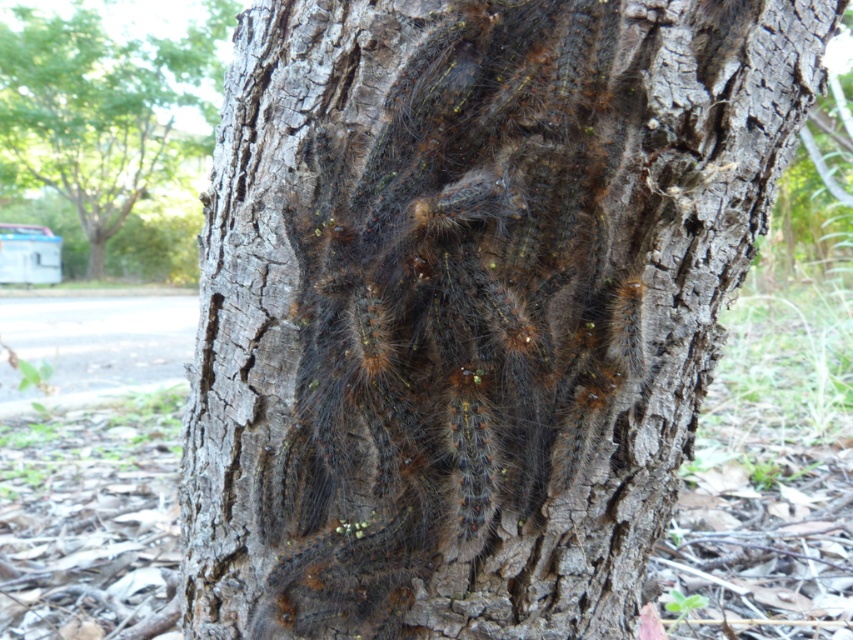
You are an entomologist observing the tree trunk. You notice two clusters of caterpillars. Which cluster, the fuzzy brown caterpillars at center or the brown fuzzy caterpillars at upper center, covers a smaller area of the tree trunk?

The fuzzy brown caterpillars at center occupies less space than brown fuzzy caterpillars at upper center, so the fuzzy brown caterpillars at center covers a smaller area.

In the scene shown: You are a bird flying over a tree in the park. You see fuzzy brown caterpillars at center and brown fuzzy caterpillars at upper center. Which group of caterpillars is lower on the tree trunk?

The fuzzy brown caterpillars at center is positioned under brown fuzzy caterpillars at upper center, so the fuzzy brown caterpillars at center are lower on the tree trunk.

Looking at this image, you are standing in a park and see the fuzzy brown caterpillars at center on a tree trunk. If you want to take a photo of them, where should you aim your camera?

You should aim your camera at the point with coordinates (457,314) where the fuzzy brown caterpillars at center are located.